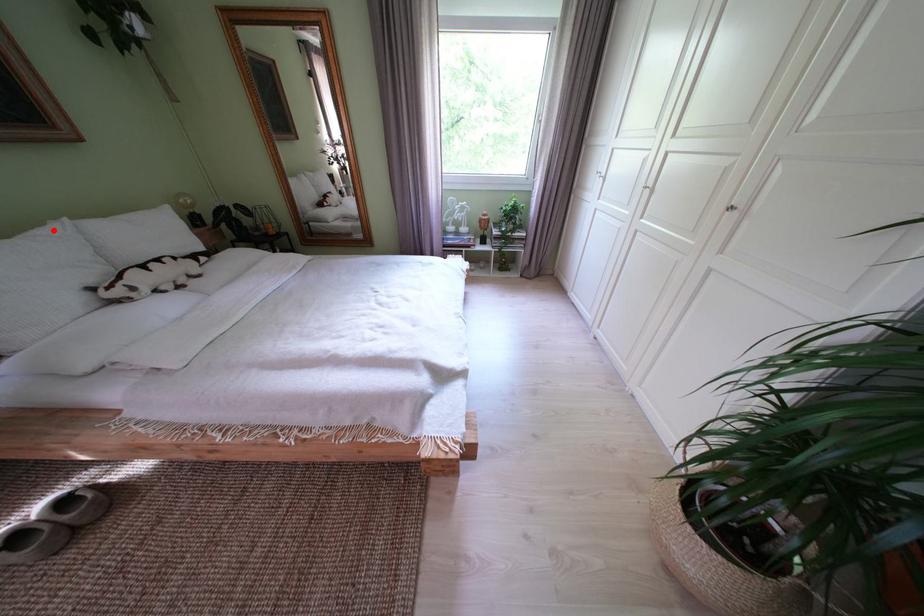
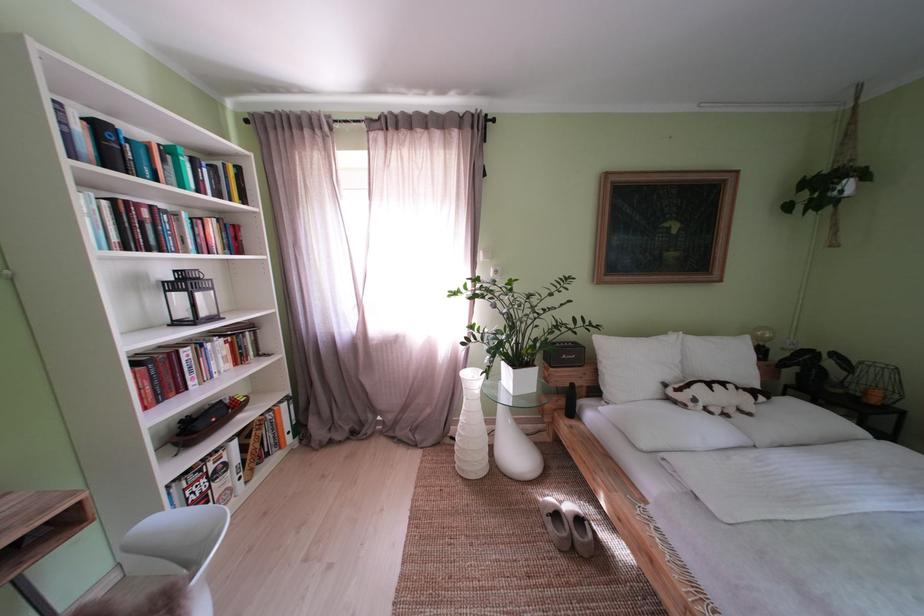
In the second image, find the point that corresponds to the highlighted location in the first image.

(675, 338)